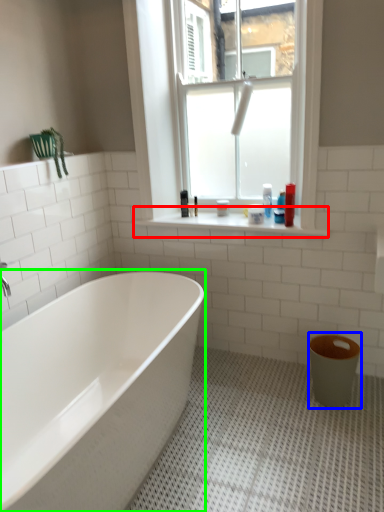
Question: Which object is positioned farthest from window sill (highlighted by a red box)? Select from toilet bowl (highlighted by a blue box) and bathtub (highlighted by a green box).

Choices:
 (A) toilet bowl
 (B) bathtub

Answer: (B)